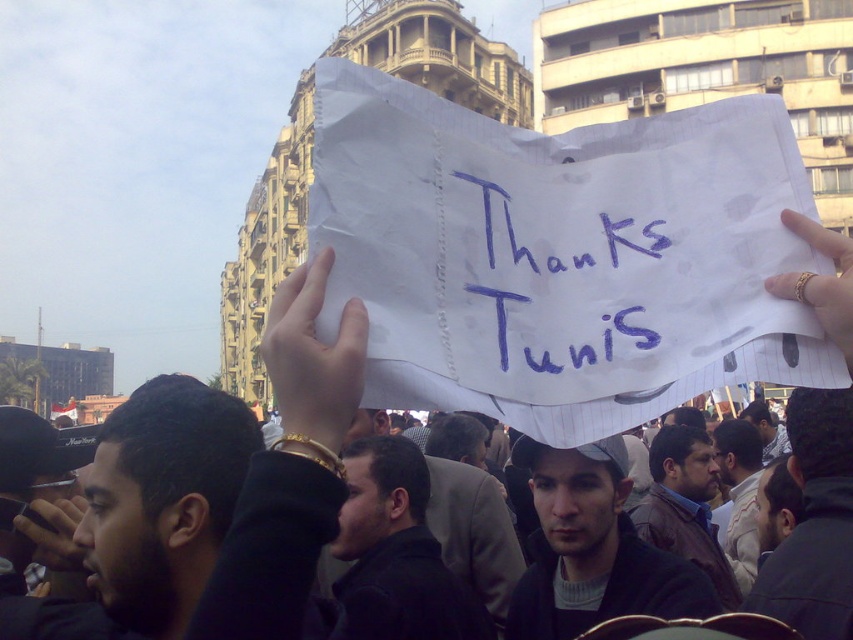
Can you confirm if gold ring at upper right is positioned below matte black camera at lower left?

No, gold ring at upper right is not below matte black camera at lower left.

From the picture: Which is more to the left, gold ring at upper right or matte black camera at lower left?

Positioned to the left is matte black camera at lower left.

What do you see at coordinates (821, 282) in the screenshot?
I see `gold ring at upper right` at bounding box center [821, 282].

Find the location of a particular element. Image resolution: width=853 pixels, height=640 pixels. gold ring at upper right is located at coordinates (821, 282).

Does blue handwritten sign at center appear on the right side of dark gray cap at center?

In fact, blue handwritten sign at center is to the left of dark gray cap at center.

Is blue handwritten sign at center to the left of dark gray cap at center from the viewer's perspective?

Correct, you'll find blue handwritten sign at center to the left of dark gray cap at center.

Is point (524, 196) positioned before point (585, 452)?

That is True.

Locate an element on the screen. Image resolution: width=853 pixels, height=640 pixels. blue handwritten sign at center is located at coordinates (550, 272).

Does white paper at center have a lesser width compared to matte black camera at lower left?

No, white paper at center is not thinner than matte black camera at lower left.

Does white paper at center have a greater height compared to matte black camera at lower left?

Correct, white paper at center is much taller as matte black camera at lower left.

Does point (323, 400) come farther from viewer compared to point (51, 548)?

No.

Identify the location of white paper at center. The image size is (853, 640). (312, 356).